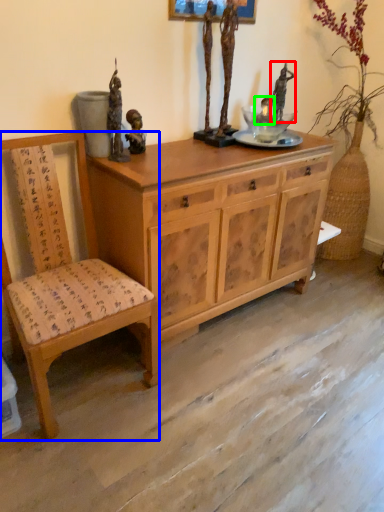
Question: Which object is the farthest from person (highlighted by a red box)? Choose among these: chair (highlighted by a blue box) or person (highlighted by a green box).

Choices:
 (A) chair
 (B) person

Answer: (A)